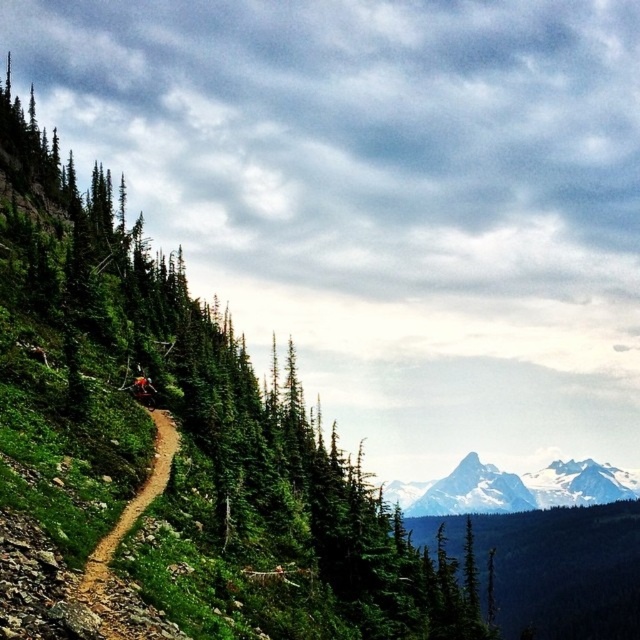
Can you confirm if green leafy tree at center-left is bigger than white snow-covered mountain at center?

Correct, green leafy tree at center-left is larger in size than white snow-covered mountain at center.

Is green leafy tree at center-left shorter than white snow-covered mountain at center?

No, green leafy tree at center-left is not shorter than white snow-covered mountain at center.

Is point (353, 474) farther from camera compared to point (412, 516)?

No, it is in front of (412, 516).

Image resolution: width=640 pixels, height=640 pixels. What are the coordinates of `green leafy tree at center-left` in the screenshot? It's located at (186, 435).